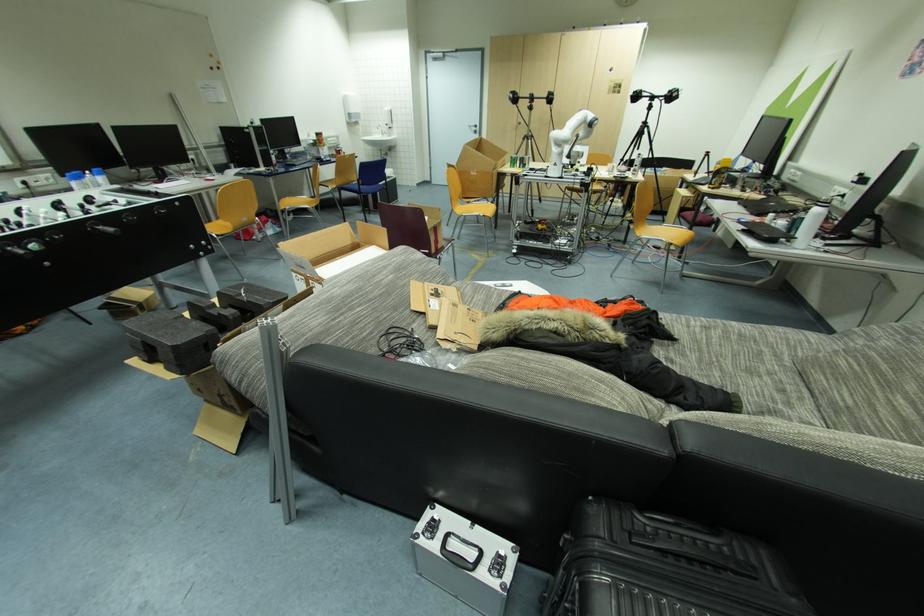
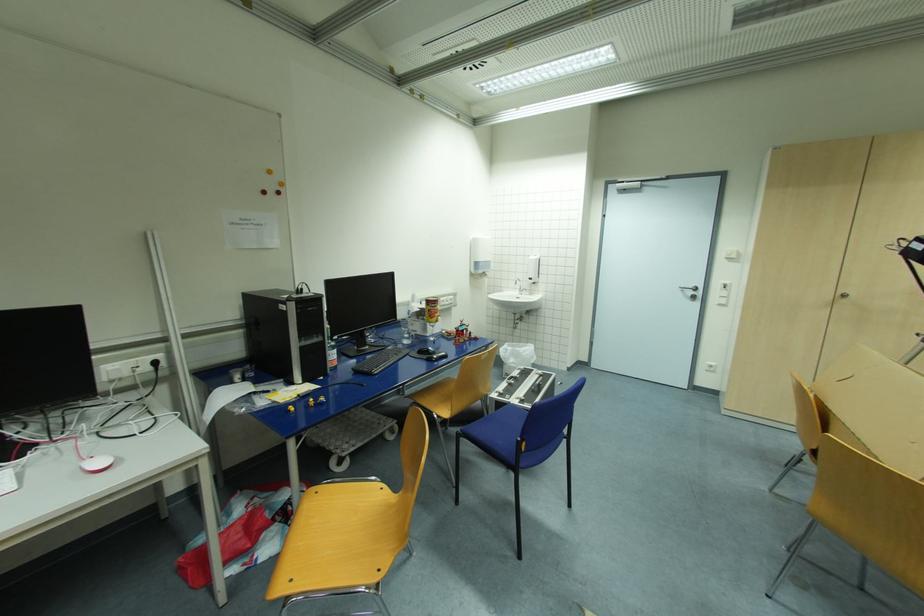
Where in the second image is the point corresponding to the point at 386,135 from the first image?

(525, 291)